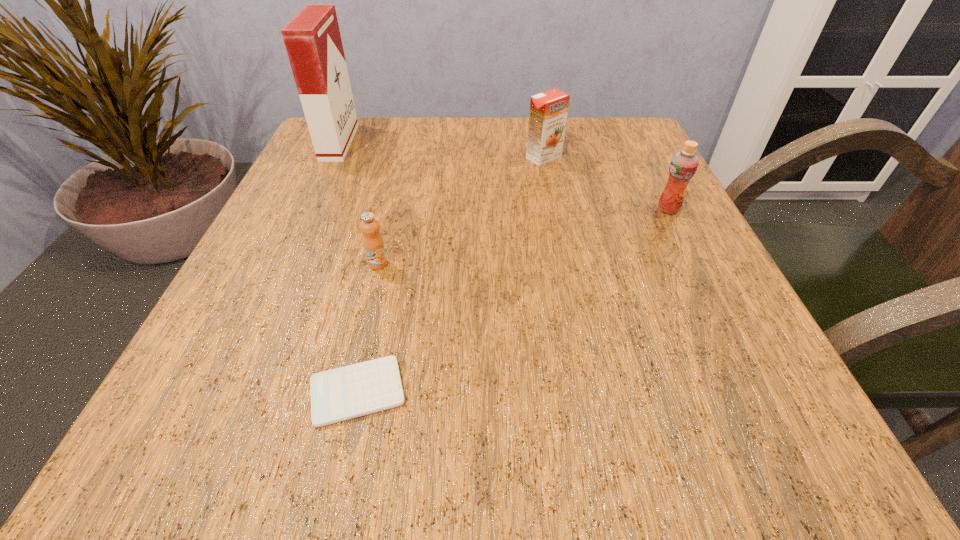
Locate an element on the screen. blank region between the tallest object and the third farthest object is located at coordinates (504, 176).

In order to click on vacant region between the calculator and the shortest orange juice in this screenshot , I will do `click(368, 327)`.

Identify the location of vacant area that lies between the calculator and the farthest orange juice. (451, 274).

Identify the location of vacant area between the leftmost object and the shortest object. (348, 267).

Find the location of a particular element. The image size is (960, 540). vacant area that lies between the farthest orange juice and the leftmost orange juice is located at coordinates (461, 210).

At what (x,y) coordinates should I click in order to perform the action: click on free space between the second farthest orange juice and the fourth object from left to right. Please return your answer as a coordinate pair (x, y). Looking at the image, I should click on (606, 183).

Select which object is the fourth closest to the nearest object. Please provide its 2D coordinates. Your answer should be formatted as a tuple, i.e. [(x, y)], where the tuple contains the x and y coordinates of a point satisfying the conditions above.

[(684, 163)]

Select which object appears as the second closest to the tallest object. Please provide its 2D coordinates. Your answer should be formatted as a tuple, i.e. [(x, y)], where the tuple contains the x and y coordinates of a point satisfying the conditions above.

[(548, 113)]

Where is `orange juice that is the nearest to the second nearest object`? orange juice that is the nearest to the second nearest object is located at coordinates (548, 113).

You are a GUI agent. You are given a task and a screenshot of the screen. Output one action in this format:
    pyautogui.click(x=<x>, y=<y>)
    Task: Click on the orange juice that is the nearest to the shortest orange juice
    This screenshot has height=540, width=960.
    Given the screenshot: What is the action you would take?
    pyautogui.click(x=548, y=113)